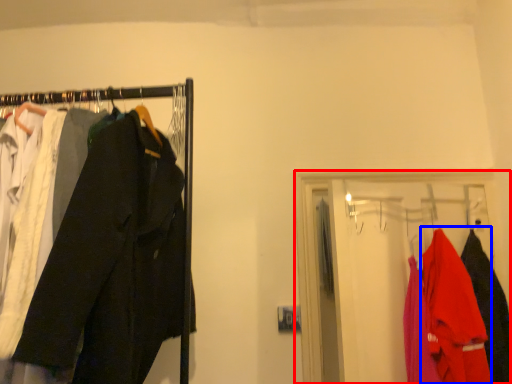
Question: Which point is closer to the camera, closet (highlighted by a red box) or clothing (highlighted by a blue box)?

Choices:
 (A) closet
 (B) clothing

Answer: (B)